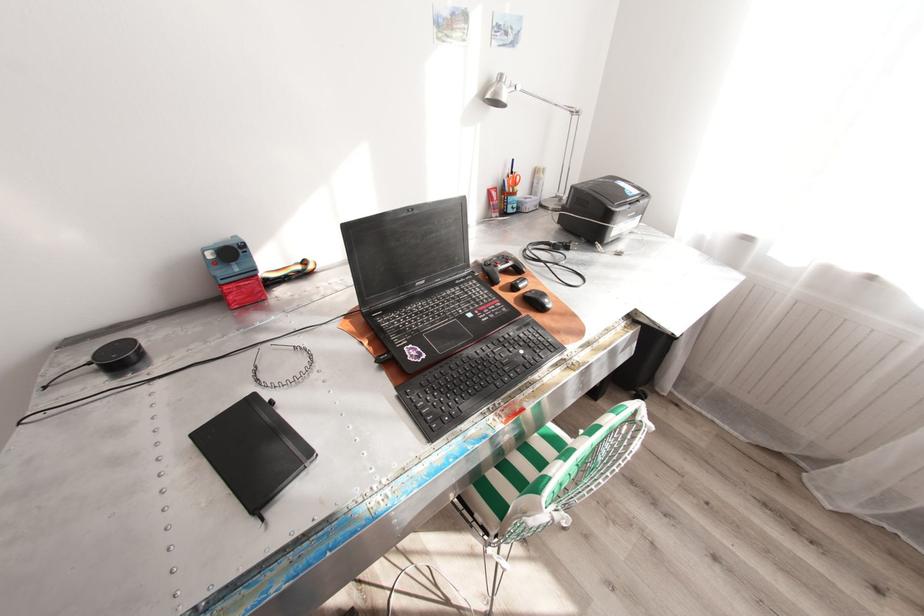
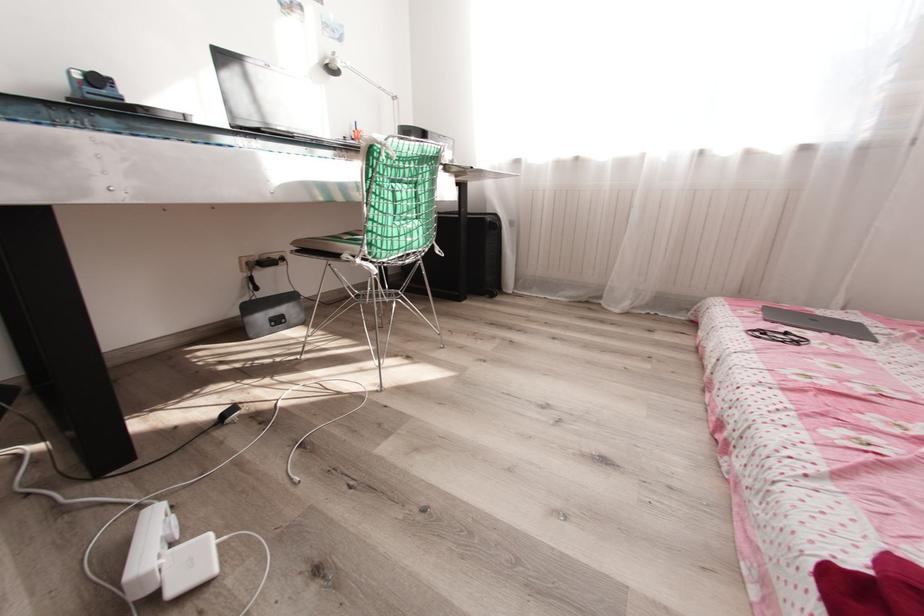
Question: In a continuous first-person perspective shot, in which direction is the camera moving?

Choices:
 (A) Left
 (B) Right
 (C) Forward
 (D) Backward

Answer: (D)